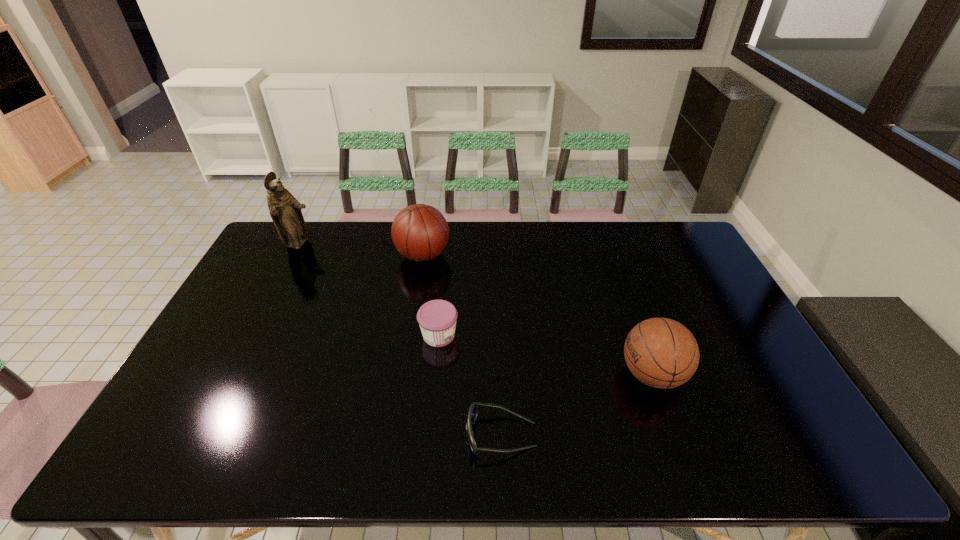
The width and height of the screenshot is (960, 540). Find the location of `free space between the leftmost object and the shortest object`. free space between the leftmost object and the shortest object is located at coordinates (400, 340).

The width and height of the screenshot is (960, 540). I want to click on blank region between the second shortest object and the sunglasses, so click(x=470, y=385).

Locate an element on the screen. vacant point located between the fourth object from left to right and the jam is located at coordinates (470, 385).

The height and width of the screenshot is (540, 960). Find the location of `free space that is in between the right basketball and the leftmost object`. free space that is in between the right basketball and the leftmost object is located at coordinates (475, 309).

This screenshot has height=540, width=960. Find the location of `vacant area that lies between the nearest object and the second shortest object`. vacant area that lies between the nearest object and the second shortest object is located at coordinates (470, 385).

Locate an element on the screen. The width and height of the screenshot is (960, 540). unoccupied position between the fourth tallest object and the rightmost object is located at coordinates (545, 355).

Find the location of `free space between the jam and the sunglasses`. free space between the jam and the sunglasses is located at coordinates (470, 385).

Where is `object that is the third closest to the second shortest object`? object that is the third closest to the second shortest object is located at coordinates (662, 353).

Locate an element on the screen. This screenshot has height=540, width=960. object that can be found as the third closest to the nearer basketball is located at coordinates (420, 232).

This screenshot has height=540, width=960. Identify the location of free space that satisfies the following two spatial constraints: 1. on the front-facing side of the figurine; 2. on the back side of the farther basketball. (294, 255).